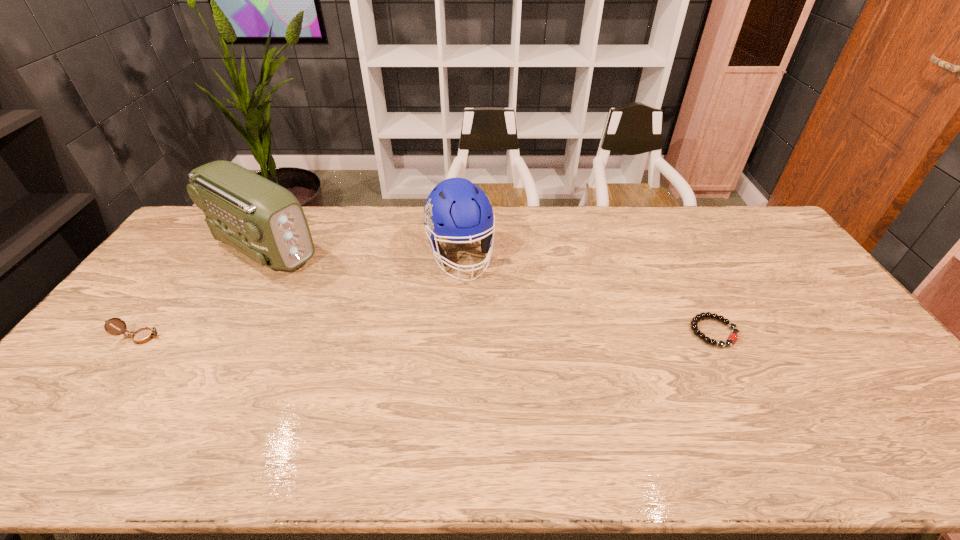
The height and width of the screenshot is (540, 960). I want to click on free space on the desktop that is between the third tallest object and the rightmost object and is positioned on the face guard of the football helmet, so click(x=490, y=334).

Find the location of a particular element. Image resolution: width=960 pixels, height=540 pixels. vacant space on the desktop that is between the compass and the shortest object and is positioned on the front-facing side of the radio_receiver is located at coordinates (407, 335).